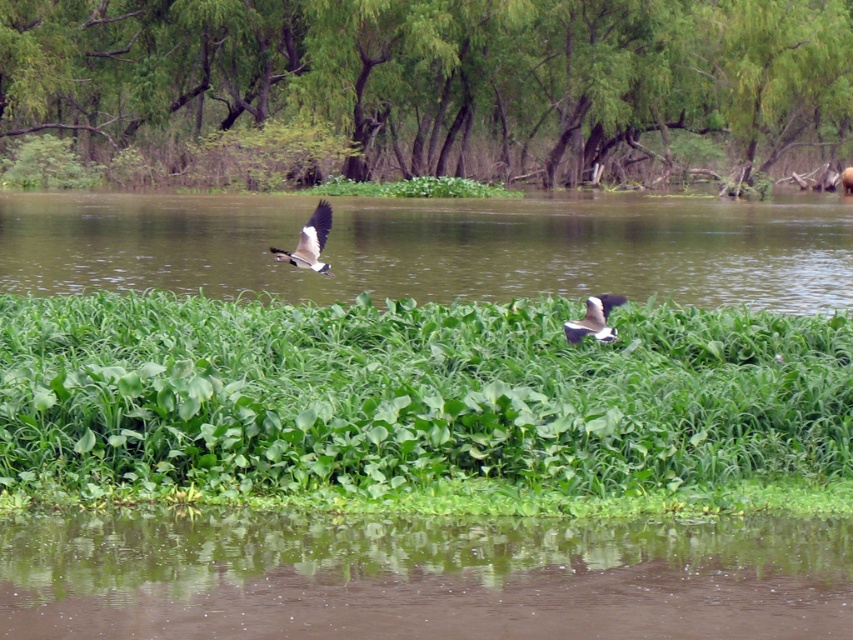
You are observing the scene and want to know which bird is taller. Based on their positions, can you determine which one is taller between the gray feathered bird at upper center and the white glossy duck at center?

The gray feathered bird at upper center is taller than the white glossy duck at center.

Looking at this image, you are standing at the edge of the water and want to place a small wooden boat in the brown reflective water at center. The boat requires at least 5 meters of space to avoid the green leafy grass at center. Can you determine if there is enough space?

The green leafy grass at center is narrower than the brown reflective water at center, so the boat can be placed safely as there is sufficient space between them.

You are standing at the edge of the water and see the gray feathered bird at upper center and the white glossy duck at center. Which bird is closer to you?

The gray feathered bird at upper center is closer to you because the white glossy duck at center is behind it.